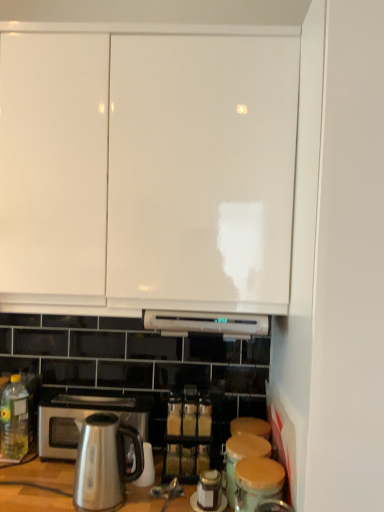
Question: From the image's perspective, would you say matte brown canister at lower right, the 2th appliance from the back, is positioned over satin metallic kettle at lower left?

Choices:
 (A) yes
 (B) no

Answer: (B)

Question: Is matte brown canister at lower right, the first appliance in the front-to-back sequence, not near satin metallic kettle at lower left?

Choices:
 (A) yes
 (B) no

Answer: (B)

Question: Does matte brown canister at lower right, the 2th appliance from the back, have a greater height compared to satin metallic kettle at lower left?

Choices:
 (A) yes
 (B) no

Answer: (B)

Question: Is matte brown canister at lower right, the 2th appliance from the back, completely or partially outside of satin metallic kettle at lower left?

Choices:
 (A) yes
 (B) no

Answer: (A)

Question: From the image's perspective, is matte brown canister at lower right, the first appliance in the front-to-back sequence, beneath satin metallic kettle at lower left?

Choices:
 (A) yes
 (B) no

Answer: (A)

Question: From a real-world perspective, is yellow translucent bottle at lower left physically located above or below satin silver microwave oven at lower left?

Choices:
 (A) above
 (B) below

Answer: (A)

Question: Is yellow translucent bottle at lower left inside the boundaries of satin silver microwave oven at lower left, or outside?

Choices:
 (A) outside
 (B) inside

Answer: (A)

Question: From the image's perspective, is yellow translucent bottle at lower left positioned above or below satin silver microwave oven at lower left?

Choices:
 (A) above
 (B) below

Answer: (A)

Question: Is point (19, 404) closer or farther from the camera than point (89, 408)?

Choices:
 (A) farther
 (B) closer

Answer: (A)

Question: Is wooden lid canister at lower center, the first appliance when ordered from back to front, situated inside translucent glass spice jar at center or outside?

Choices:
 (A) outside
 (B) inside

Answer: (A)

Question: Is wooden lid canister at lower center, the first appliance when ordered from back to front, wider or thinner than translucent glass spice jar at center?

Choices:
 (A) thin
 (B) wide

Answer: (A)

Question: Would you say wooden lid canister at lower center, the first appliance when ordered from back to front, is to the left or to the right of translucent glass spice jar at center in the picture?

Choices:
 (A) right
 (B) left

Answer: (A)

Question: Is wooden lid canister at lower center, the first appliance when ordered from back to front, taller or shorter than translucent glass spice jar at center?

Choices:
 (A) short
 (B) tall

Answer: (A)

Question: From their relative heights in the image, would you say yellow translucent bottle at lower left is taller or shorter than satin metallic kettle at lower left?

Choices:
 (A) tall
 (B) short

Answer: (A)

Question: Which is correct: yellow translucent bottle at lower left is inside satin metallic kettle at lower left, or outside of it?

Choices:
 (A) inside
 (B) outside

Answer: (B)